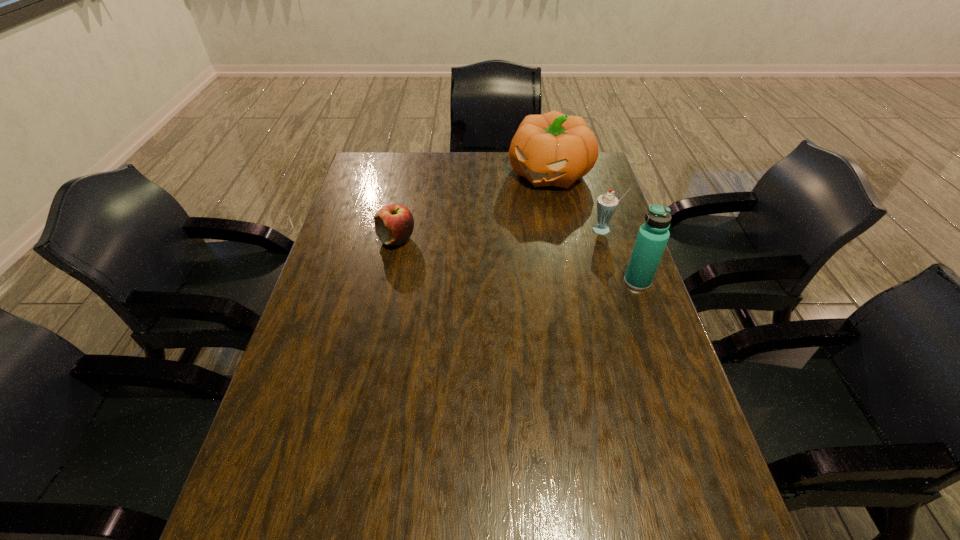
Find the location of a particular element. vacant region located on the carved face of the farthest object is located at coordinates (497, 232).

The height and width of the screenshot is (540, 960). Find the location of `vacant space positioned 0.050m on the carved face of the farthest object`. vacant space positioned 0.050m on the carved face of the farthest object is located at coordinates (525, 200).

This screenshot has height=540, width=960. Identify the location of vacant space situated on the carved face of the farthest object. (475, 258).

You are a GUI agent. You are given a task and a screenshot of the screen. Output one action in this format:
    pyautogui.click(x=<x>, y=<y>)
    Task: Click on the object positioned at the far edge
    This screenshot has width=960, height=540.
    Given the screenshot: What is the action you would take?
    pyautogui.click(x=552, y=149)

The width and height of the screenshot is (960, 540). I want to click on object that is at the left edge, so click(x=394, y=223).

Where is `thermos bottle at the right edge`? The image size is (960, 540). thermos bottle at the right edge is located at coordinates (653, 235).

Identify the location of milkshake present at the right edge. tap(607, 203).

The width and height of the screenshot is (960, 540). In order to click on pumpkin that is at the right edge in this screenshot , I will do `click(552, 149)`.

I want to click on object present at the far right corner, so click(552, 149).

I want to click on free space at the far edge, so click(421, 173).